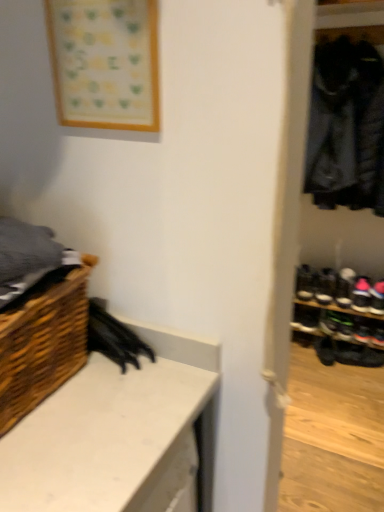
The image size is (384, 512). I want to click on woven wood basket at lower left, so click(x=43, y=340).

What do you see at coordinates (347, 353) in the screenshot?
I see `black leather shoe at lower right, which appears as the first footwear when ordered from the bottom` at bounding box center [347, 353].

What is the approximate height of black leather shoe at lower right, which appears as the first footwear when ordered from the bottom?

6.37 inches.

Find the location of a particular element. Image resolution: width=384 pixels, height=512 pixels. black suede shoe at right, which appears as the 3th footwear when ordered from the bottom is located at coordinates (361, 294).

How much space does black suede shoe at right, which appears as the 3th footwear when ordered from the bottom, occupy vertically?

black suede shoe at right, which appears as the 3th footwear when ordered from the bottom, is 4.18 inches tall.

What do you see at coordinates (344, 287) in the screenshot? The width and height of the screenshot is (384, 512). I see `black suede shoe at lower right, the first footwear viewed from the top` at bounding box center [344, 287].

Identify the location of black suede shoe at lower right, the first footwear viewed from the top. (344, 287).

Where is `woven wood basket at lower left`? woven wood basket at lower left is located at coordinates (43, 340).

From the image's perspective, is black leather shoe at right, which is the 3th footwear from top to bottom, positioned above or below woven wood basket at lower left?

From the image's perspective, black leather shoe at right, which is the 3th footwear from top to bottom, appears below woven wood basket at lower left.

Consider the image. Considering the positions of objects black leather shoe at right, which is the 3th footwear from top to bottom, and woven wood basket at lower left in the image provided, who is more to the left, black leather shoe at right, which is the 3th footwear from top to bottom, or woven wood basket at lower left?

woven wood basket at lower left.

From a real-world perspective, does black leather shoe at right, which is the 3th footwear from top to bottom, stand above woven wood basket at lower left?

No, from a real-world perspective, black leather shoe at right, which is the 3th footwear from top to bottom, is not above woven wood basket at lower left.

What's the angular difference between black leather shoe at right, the second footwear ordered from the bottom, and woven wood basket at lower left's facing directions?

82.6 degrees separate the facing orientations of black leather shoe at right, the second footwear ordered from the bottom, and woven wood basket at lower left.

Is black leather shoe at lower right, which appears as the first footwear when ordered from the bottom, shorter than black suede shoe at right, positioned as the second footwear in top-to-bottom order?

No, black leather shoe at lower right, which appears as the first footwear when ordered from the bottom, is not shorter than black suede shoe at right, positioned as the second footwear in top-to-bottom order.

Is black leather shoe at lower right, which appears as the first footwear when ordered from the bottom, not within black suede shoe at right, positioned as the second footwear in top-to-bottom order?

That's correct, black leather shoe at lower right, which appears as the first footwear when ordered from the bottom, is outside of black suede shoe at right, positioned as the second footwear in top-to-bottom order.

Is black leather shoe at lower right, acting as the 4th footwear starting from the top, positioned far away from black suede shoe at right, which appears as the 3th footwear when ordered from the bottom?

No, black leather shoe at lower right, acting as the 4th footwear starting from the top, is not far away from black suede shoe at right, which appears as the 3th footwear when ordered from the bottom.

Between black leather shoe at lower right, acting as the 4th footwear starting from the top, and black suede shoe at right, positioned as the second footwear in top-to-bottom order, which one appears on the left side from the viewer's perspective?

From the viewer's perspective, black leather shoe at lower right, acting as the 4th footwear starting from the top, appears more on the left side.

Consider the image. Is woven wood basket at lower left bigger than white matte counter at lower left?

Incorrect, woven wood basket at lower left is not larger than white matte counter at lower left.

From a real-world perspective, between woven wood basket at lower left and white matte counter at lower left, who is vertically higher?

From a 3D spatial view, woven wood basket at lower left is above.

Is woven wood basket at lower left at the right side of white matte counter at lower left?

In fact, woven wood basket at lower left is to the left of white matte counter at lower left.

Does point (115, 7) come in front of point (44, 348)?

Yes, point (115, 7) is in front of point (44, 348).

Would you say wooden frame at upper left is outside woven wood basket at lower left?

Indeed, wooden frame at upper left is completely outside woven wood basket at lower left.

From a real-world perspective, is wooden frame at upper left positioned over woven wood basket at lower left based on gravity?

Yes, from a real-world perspective, wooden frame at upper left is over woven wood basket at lower left

This screenshot has width=384, height=512. What are the coordinates of `picture frame above the woven wood basket at lower left (from a real-world perspective)` in the screenshot? It's located at (105, 63).

Does white matte counter at lower left turn towards black suede shoe at right, positioned as the second footwear in top-to-bottom order?

No.

From a real-world perspective, does white matte counter at lower left stand above black suede shoe at right, positioned as the second footwear in top-to-bottom order?

Correct, in the physical world, white matte counter at lower left is higher than black suede shoe at right, positioned as the second footwear in top-to-bottom order.

Between white matte counter at lower left and black suede shoe at right, which appears as the 3th footwear when ordered from the bottom, which one has more height?

With more height is white matte counter at lower left.

From the image's perspective, is white matte counter at lower left under black suede shoe at right, positioned as the second footwear in top-to-bottom order?

Yes, from the image's perspective, white matte counter at lower left is below black suede shoe at right, positioned as the second footwear in top-to-bottom order.

Between wooden frame at upper left and black suede shoe at right, which appears as the 3th footwear when ordered from the bottom, which one appears on the right side from the viewer's perspective?

black suede shoe at right, which appears as the 3th footwear when ordered from the bottom, is more to the right.

From the image's perspective, between wooden frame at upper left and black suede shoe at right, which appears as the 3th footwear when ordered from the bottom, who is located below?

black suede shoe at right, which appears as the 3th footwear when ordered from the bottom, from the image's perspective.

From a real-world perspective, who is located lower, wooden frame at upper left or black suede shoe at right, positioned as the second footwear in top-to-bottom order?

black suede shoe at right, positioned as the second footwear in top-to-bottom order, from a real-world perspective.

Is there a large distance between wooden frame at upper left and black suede shoe at right, positioned as the second footwear in top-to-bottom order?

Yes, wooden frame at upper left and black suede shoe at right, positioned as the second footwear in top-to-bottom order, are located far from each other.

Can you tell me how much black suede shoe at lower right, the first footwear viewed from the top, and wooden frame at upper left differ in facing direction?

The angular difference between black suede shoe at lower right, the first footwear viewed from the top, and wooden frame at upper left is 9.65 degrees.

Between black suede shoe at lower right, acting as the fourth footwear starting from the bottom, and wooden frame at upper left, which one has larger size?

black suede shoe at lower right, acting as the fourth footwear starting from the bottom.

From the image's perspective, is black suede shoe at lower right, acting as the fourth footwear starting from the bottom, on wooden frame at upper left?

Incorrect, from the image's perspective, black suede shoe at lower right, acting as the fourth footwear starting from the bottom, is lower than wooden frame at upper left.

From a real-world perspective, is black suede shoe at lower right, the first footwear viewed from the top, physically located above or below wooden frame at upper left?

From a real-world perspective, black suede shoe at lower right, the first footwear viewed from the top, is physically below wooden frame at upper left.

Locate an element on the screen. This screenshot has width=384, height=512. the 3rd footwear below the woven wood basket at lower left (from the image's perspective) is located at coordinates (377, 298).

Starting from the black leather shoe at lower right, which appears as the first footwear when ordered from the bottom, which footwear is the 1st one behind? Please provide its 2D coordinates.

[(361, 294)]

Estimate the real-world distances between objects in this image. Which object is further from black suede shoe at right, which appears as the 3th footwear when ordered from the bottom, black leather shoe at right, the second footwear ordered from the bottom, or white matte counter at lower left?

Based on the image, white matte counter at lower left appears to be further to black suede shoe at right, which appears as the 3th footwear when ordered from the bottom.

Estimate the real-world distances between objects in this image. Which object is further from black leather shoe at right, which is the 3th footwear from top to bottom, black leather shoe at lower right, which appears as the first footwear when ordered from the bottom, or black suede shoe at lower right, acting as the fourth footwear starting from the bottom?

black leather shoe at lower right, which appears as the first footwear when ordered from the bottom, is further to black leather shoe at right, which is the 3th footwear from top to bottom.

Based on their spatial positions, is wooden frame at upper left or black leather shoe at right, which is the 3th footwear from top to bottom, further from black leather shoe at lower right, acting as the 4th footwear starting from the top?

wooden frame at upper left is positioned further to the anchor black leather shoe at lower right, acting as the 4th footwear starting from the top.

Estimate the real-world distances between objects in this image. Which object is closer to wooden frame at upper left, black leather shoe at lower right, which appears as the first footwear when ordered from the bottom, or black suede shoe at right, positioned as the second footwear in top-to-bottom order?

black suede shoe at right, positioned as the second footwear in top-to-bottom order, lies closer to wooden frame at upper left than the other object.

From the image, which object appears to be nearer to black leather shoe at lower right, acting as the 4th footwear starting from the top, black suede shoe at lower right, the first footwear viewed from the top, or woven wood basket at lower left?

black suede shoe at lower right, the first footwear viewed from the top, is closer to black leather shoe at lower right, acting as the 4th footwear starting from the top.

Which object lies nearer to the anchor point black leather shoe at lower right, acting as the 4th footwear starting from the top, black suede shoe at right, which appears as the 3th footwear when ordered from the bottom, or black leather shoe at right, which is the 3th footwear from top to bottom?

Among the two, black suede shoe at right, which appears as the 3th footwear when ordered from the bottom, is located nearer to black leather shoe at lower right, acting as the 4th footwear starting from the top.

Which object lies further to the anchor point black suede shoe at right, which appears as the 3th footwear when ordered from the bottom, black leather shoe at lower right, which appears as the first footwear when ordered from the bottom, or black leather shoe at right, the second footwear ordered from the bottom?

The object further to black suede shoe at right, which appears as the 3th footwear when ordered from the bottom, is black leather shoe at lower right, which appears as the first footwear when ordered from the bottom.

From the image, which object appears to be farther from black suede shoe at lower right, acting as the fourth footwear starting from the bottom, white matte counter at lower left or woven wood basket at lower left?

The object further to black suede shoe at lower right, acting as the fourth footwear starting from the bottom, is woven wood basket at lower left.

Image resolution: width=384 pixels, height=512 pixels. What are the coordinates of `picture frame located between woven wood basket at lower left and black suede shoe at right, which appears as the 3th footwear when ordered from the bottom, in the depth direction` in the screenshot? It's located at (105, 63).

Locate an element on the screen. shelf between white matte counter at lower left and black suede shoe at right, which appears as the 3th footwear when ordered from the bottom, in the front-back direction is located at coordinates (43, 340).

Locate an element on the screen. shelf between white matte counter at lower left and black suede shoe at lower right, the first footwear viewed from the top, in the front-back direction is located at coordinates (43, 340).

Image resolution: width=384 pixels, height=512 pixels. In order to click on footwear that lies between black suede shoe at right, which appears as the 3th footwear when ordered from the bottom, and black leather shoe at lower right, acting as the 4th footwear starting from the top, from top to bottom in this screenshot , I will do `click(377, 298)`.